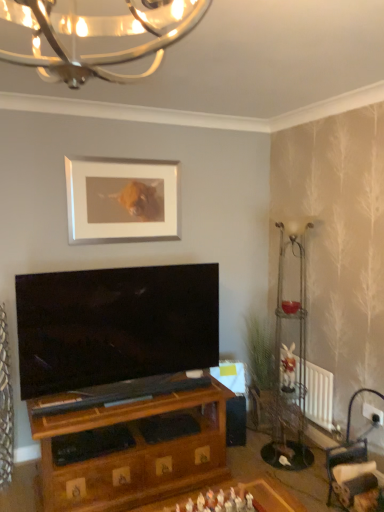
Question: Is metallic textured curtain at left taller or shorter than white radiator at lower right?

Choices:
 (A) short
 (B) tall

Answer: (B)

Question: Considering the positions of point (13, 404) and point (326, 417), is point (13, 404) closer or farther from the camera than point (326, 417)?

Choices:
 (A) farther
 (B) closer

Answer: (B)

Question: Which of these objects is positioned farthest from the metallic textured curtain at left?

Choices:
 (A) white radiator at lower right
 (B) white matte picture frame at upper center
 (C) metallic wire floor lamp at right

Answer: (A)

Question: Based on their relative distances, which object is nearer to the white matte picture frame at upper center?

Choices:
 (A) metallic textured curtain at left
 (B) metallic wire floor lamp at right
 (C) white radiator at lower right

Answer: (A)